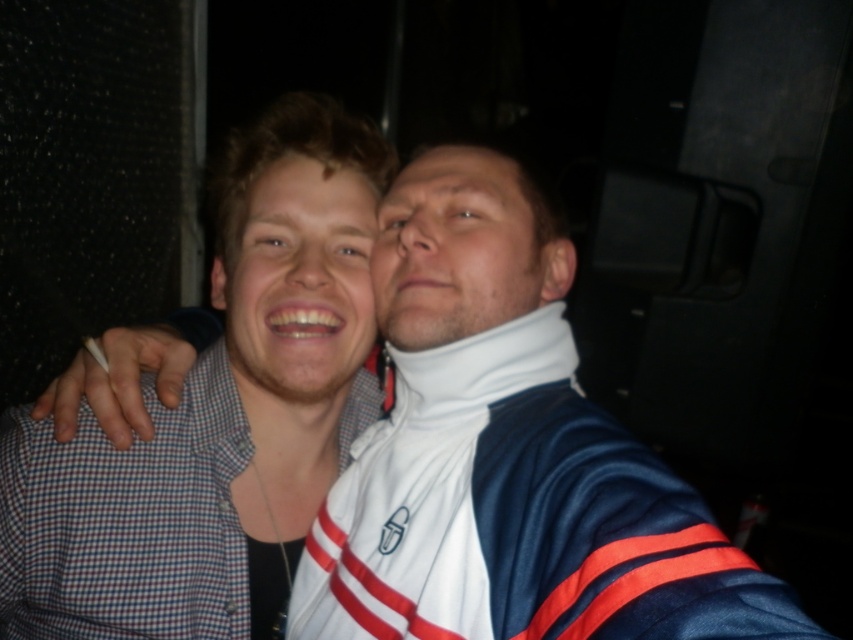
You are taking a photo of two people standing side by side. You need to ensure that the checkered fabric shirt at left and the matte skin face at center are both clearly visible in the frame. Based on their positions, which object is closer to the left edge of the photo?

The checkered fabric shirt at left is positioned on the left side of matte skin face at center, so it is closer to the left edge of the photo.

You are a photographer adjusting the lighting for a portrait session. You notice the matte skin face at center and the white matte neck brace at center in the frame. Which object should you focus on to ensure proper exposure for the subject?

The matte skin face at center should be focused on for proper exposure because it is positioned under the white matte neck brace at center, which may reflect more light and require different lighting adjustments.

You are taking a photo of two people standing in front of you. You notice two points on their clothing that are important for focusing the camera. The first point is at point (375, 225), and the second is at point (294, 243). Which point should you focus on to ensure the person closer to you is in focus?

Point (294, 243) should be focused on because it is closer to you than point (375, 225), which is behind it.